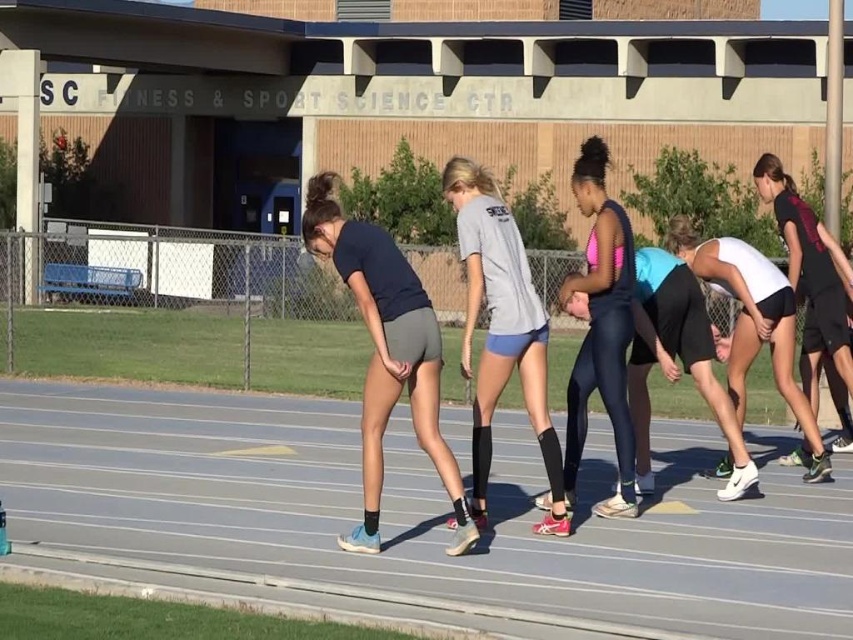
Based on the photo, who is more forward, (524, 404) or (741, 275)?

Point (741, 275) is in front.

Which is more to the right, gray cotton t-shirt at center or white matte tank top at center?

white matte tank top at center is more to the right.

Which is in front, point (553, 468) or point (668, 244)?

Positioned in front is point (553, 468).

The height and width of the screenshot is (640, 853). I want to click on gray cotton t-shirt at center, so click(502, 330).

Is white matte tank top at center positioned before black athletic shorts at right?

Yes, white matte tank top at center is in front of black athletic shorts at right.

This screenshot has width=853, height=640. What are the coordinates of `white matte tank top at center` in the screenshot? It's located at (753, 323).

Between point (788, 337) and point (850, 269), which one is positioned in front?

Positioned in front is point (788, 337).

Where is `white matte tank top at center`? This screenshot has width=853, height=640. white matte tank top at center is located at coordinates (x=753, y=323).

Does matte pink tank top at center appear under black athletic shorts at right?

Yes, matte pink tank top at center is below black athletic shorts at right.

Consider the image. Is matte pink tank top at center to the right of black athletic shorts at right from the viewer's perspective?

In fact, matte pink tank top at center is to the left of black athletic shorts at right.

In order to click on matte pink tank top at center in this screenshot , I will do `click(601, 328)`.

This screenshot has height=640, width=853. I want to click on matte pink tank top at center, so click(601, 328).